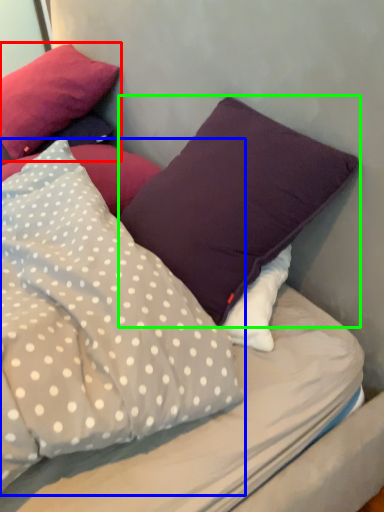
Question: Based on their relative distances, which object is nearer to pillow (highlighted by a red box)? Choose from pillow (highlighted by a blue box) and pillow (highlighted by a green box).

Choices:
 (A) pillow
 (B) pillow

Answer: (A)